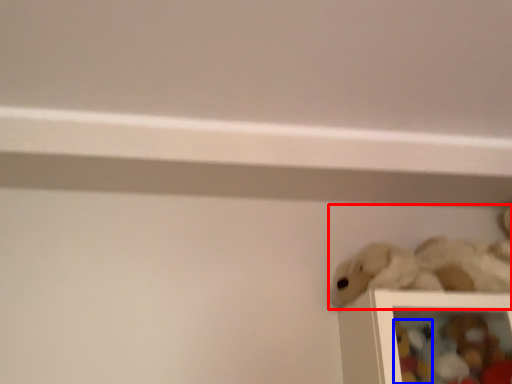
Question: Which object is closer to the camera taking this photo, toy (highlighted by a red box) or toy (highlighted by a blue box)?

Choices:
 (A) toy
 (B) toy

Answer: (A)